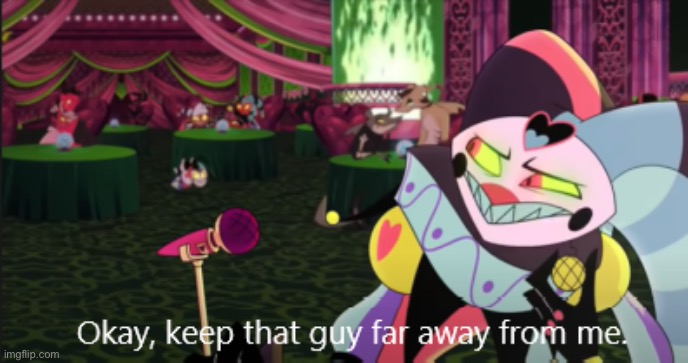
Find the location of `green tablecloth`. green tablecloth is located at coordinates (87, 160), (124, 134), (234, 139), (301, 132), (356, 185).